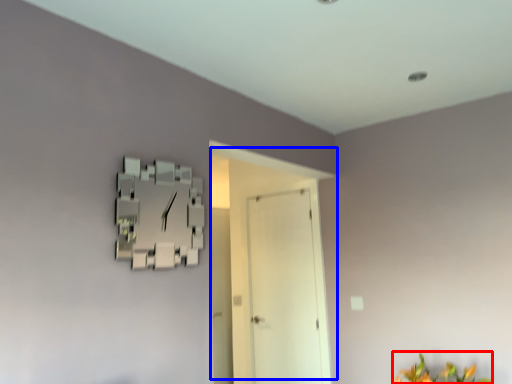
Question: Which object is closer to the camera taking this photo, flower (highlighted by a red box) or door (highlighted by a blue box)?

Choices:
 (A) flower
 (B) door

Answer: (A)